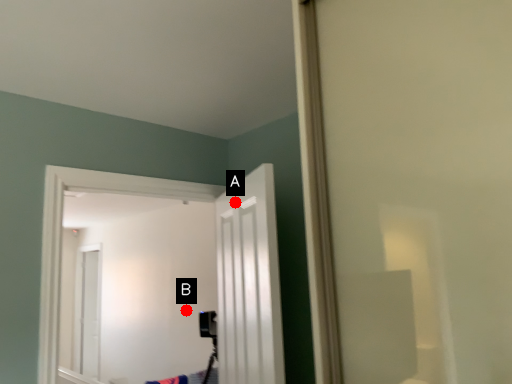
Question: Two points are circled on the image, labeled by A and B beside each circle. Which point is closer to the camera?

Choices:
 (A) A is closer
 (B) B is closer

Answer: (A)